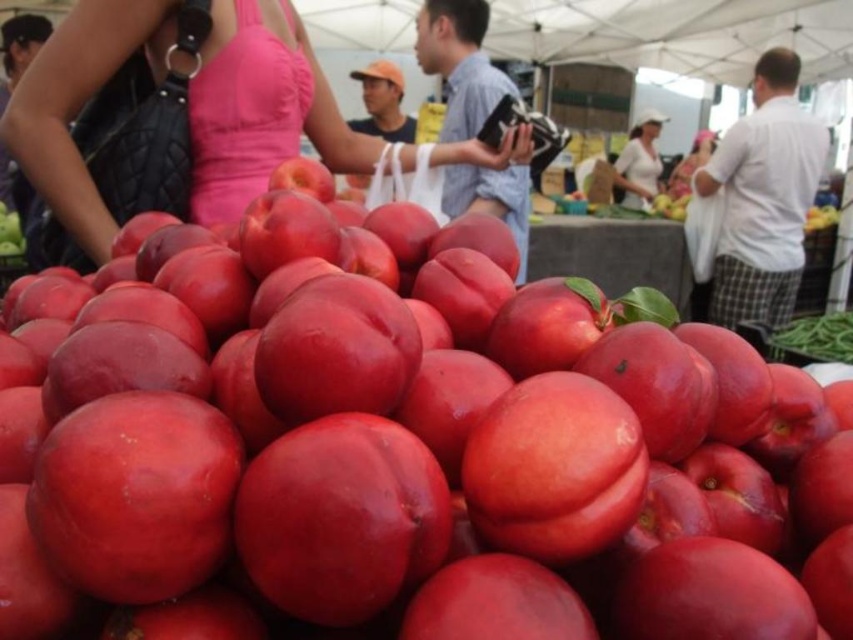
Between matte pink dress at upper center and white matte shirt at upper center, which one has less height?

With less height is matte pink dress at upper center.

Find the location of a particular element. Image resolution: width=853 pixels, height=640 pixels. matte pink dress at upper center is located at coordinates (209, 118).

Does point (198, 173) come closer to viewer compared to point (654, 129)?

Yes.

Locate an element on the screen. The width and height of the screenshot is (853, 640). matte pink dress at upper center is located at coordinates pyautogui.click(x=209, y=118).